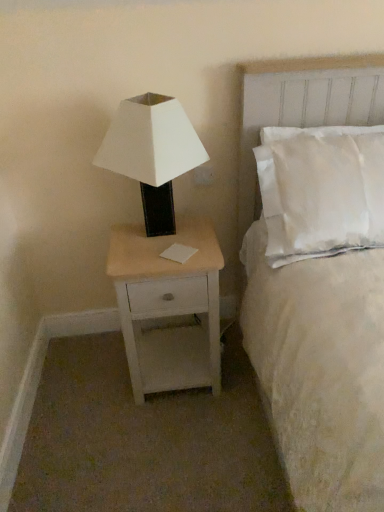
Question: Is white matte/black base lamp at left thinner than white soft bed at upper right?

Choices:
 (A) yes
 (B) no

Answer: (A)

Question: From a real-world perspective, is white matte/black base lamp at left located higher than white soft bed at upper right?

Choices:
 (A) no
 (B) yes

Answer: (B)

Question: Is white matte/black base lamp at left taller than white soft bed at upper right?

Choices:
 (A) yes
 (B) no

Answer: (B)

Question: From the image's perspective, is white matte/black base lamp at left located beneath white soft bed at upper right?

Choices:
 (A) no
 (B) yes

Answer: (A)

Question: Would you say white matte/black base lamp at left contains white soft bed at upper right?

Choices:
 (A) no
 (B) yes

Answer: (A)

Question: Is white matte/black base lamp at left wider than white soft bed at upper right?

Choices:
 (A) no
 (B) yes

Answer: (A)

Question: From the image's perspective, does white plastic electric outlet at upper right appear higher than white soft bed at upper right?

Choices:
 (A) no
 (B) yes

Answer: (B)

Question: From the image's perspective, does white plastic electric outlet at upper right appear lower than white soft bed at upper right?

Choices:
 (A) no
 (B) yes

Answer: (A)

Question: Is white plastic electric outlet at upper right to the left of white soft bed at upper right from the viewer's perspective?

Choices:
 (A) yes
 (B) no

Answer: (A)

Question: Is white plastic electric outlet at upper right at the right side of white soft bed at upper right?

Choices:
 (A) yes
 (B) no

Answer: (B)

Question: From a real-world perspective, is white plastic electric outlet at upper right beneath white soft bed at upper right?

Choices:
 (A) no
 (B) yes

Answer: (B)

Question: Is white soft bed at upper right at the back of white plastic electric outlet at upper right?

Choices:
 (A) no
 (B) yes

Answer: (A)

Question: From a real-world perspective, is white matte/black base lamp at left below light wood/white painted nightstand at lower left?

Choices:
 (A) no
 (B) yes

Answer: (A)